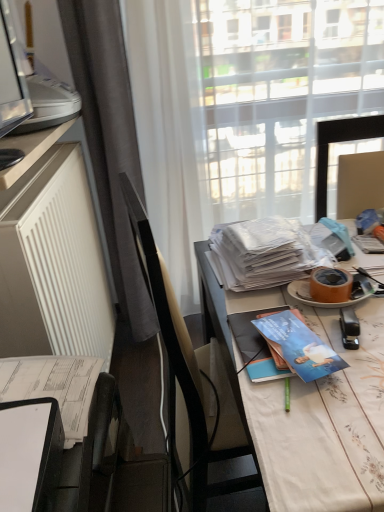
You are a GUI agent. You are given a task and a screenshot of the screen. Output one action in this format:
    pyautogui.click(x=<x>, y=<y>)
    Task: Click on the spots to the right of blue glossy book at center, the 1th magazine when ordered from bottom to top
    Image resolution: width=384 pixels, height=512 pixels.
    Given the screenshot: What is the action you would take?
    pyautogui.click(x=349, y=339)